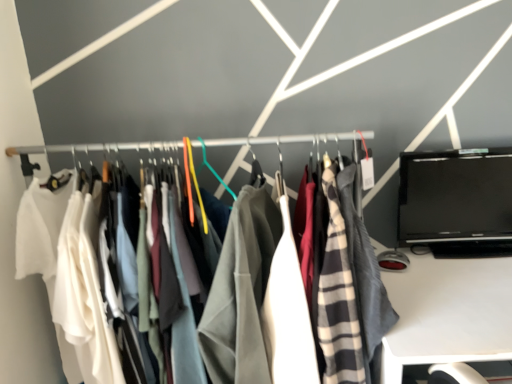
Find the location of a particular element. The height and width of the screenshot is (384, 512). free space to the left of black glossy laptop at right is located at coordinates (420, 266).